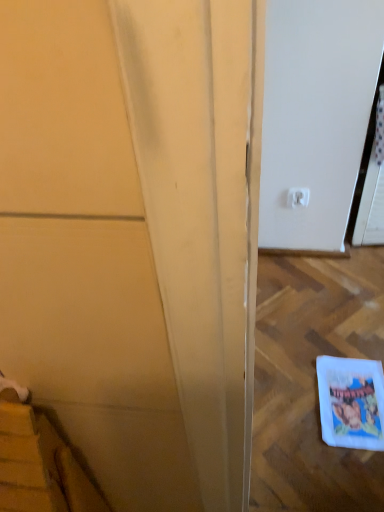
What are the coordinates of `free space to the left of white paper comic book at lower right` in the screenshot? It's located at (292, 411).